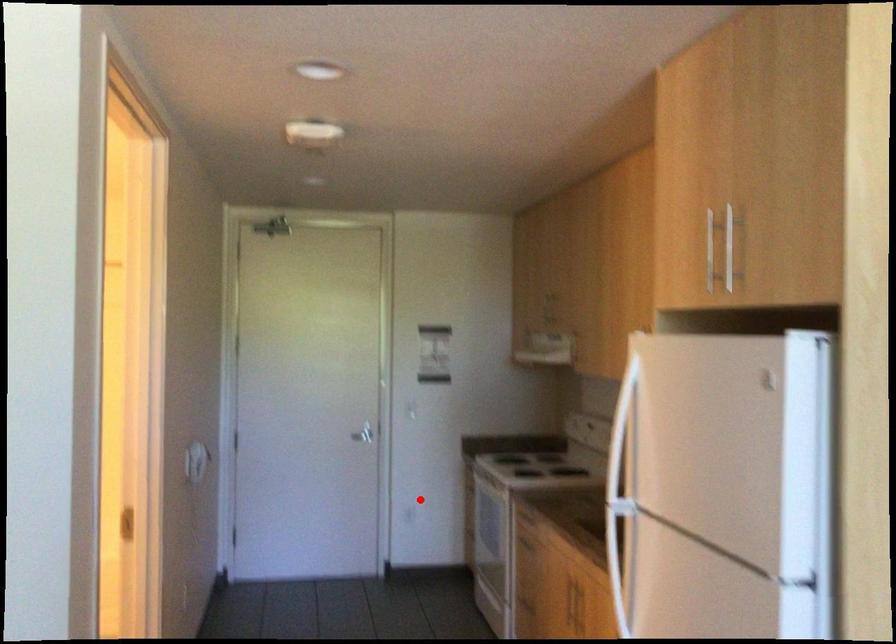
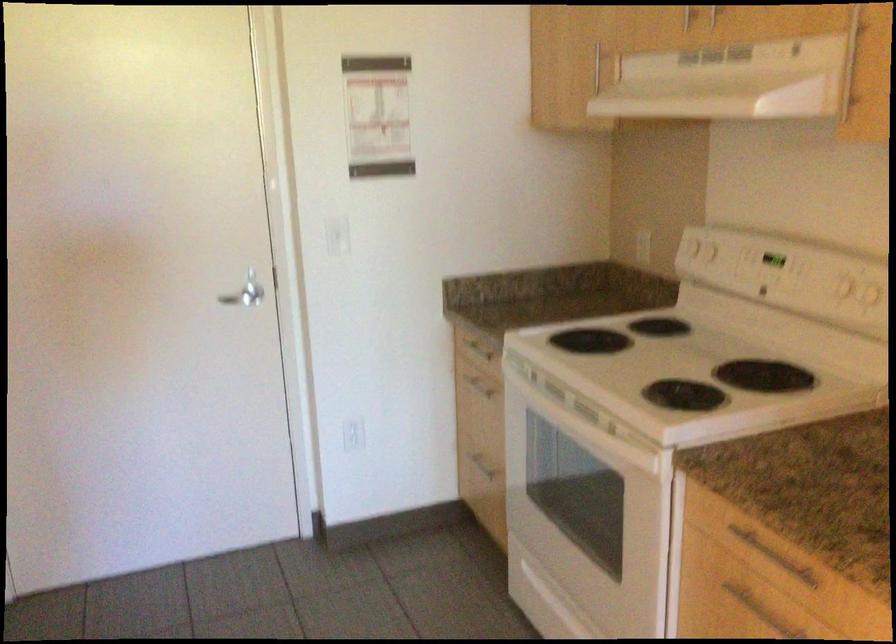
Question: I am providing you with two images of the same scene from different viewpoints. A red point is marked on the first image. At the location where the point appears in image 1, is it still visible in image 2?

Choices:
 (A) Yes
 (B) No

Answer: (A)